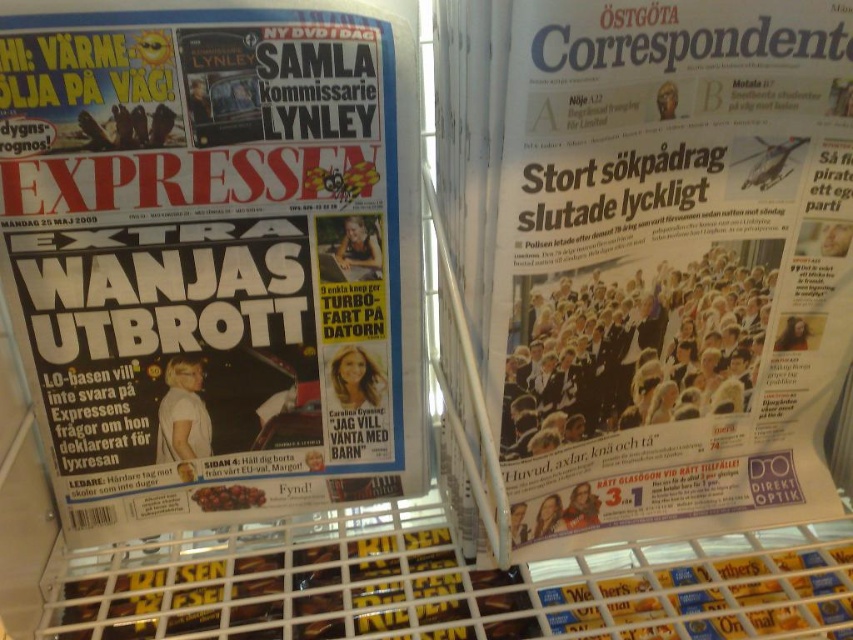
Between matte black newspaper at center and white glossy paper at upper center, which one appears on the right side from the viewer's perspective?

white glossy paper at upper center

Who is shorter, matte black newspaper at center or white glossy paper at upper center?

With less height is matte black newspaper at center.

Find the location of a particular element. The width and height of the screenshot is (853, 640). matte black newspaper at center is located at coordinates (213, 253).